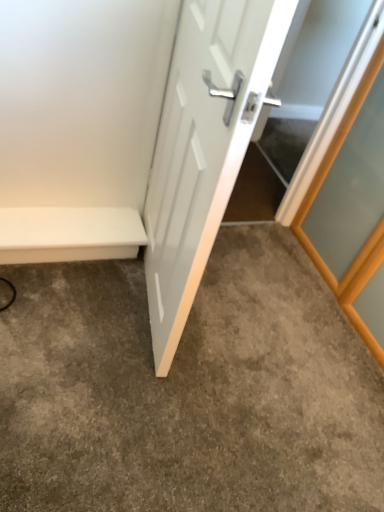
Locate an element on the screen. This screenshot has width=384, height=512. vacant space situated on the left part of white glossy door at center is located at coordinates (81, 291).